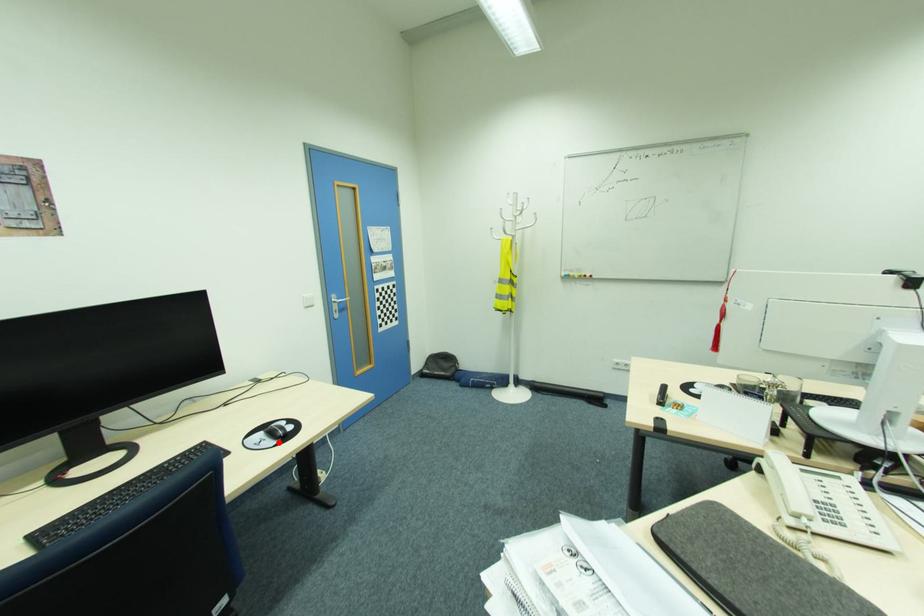
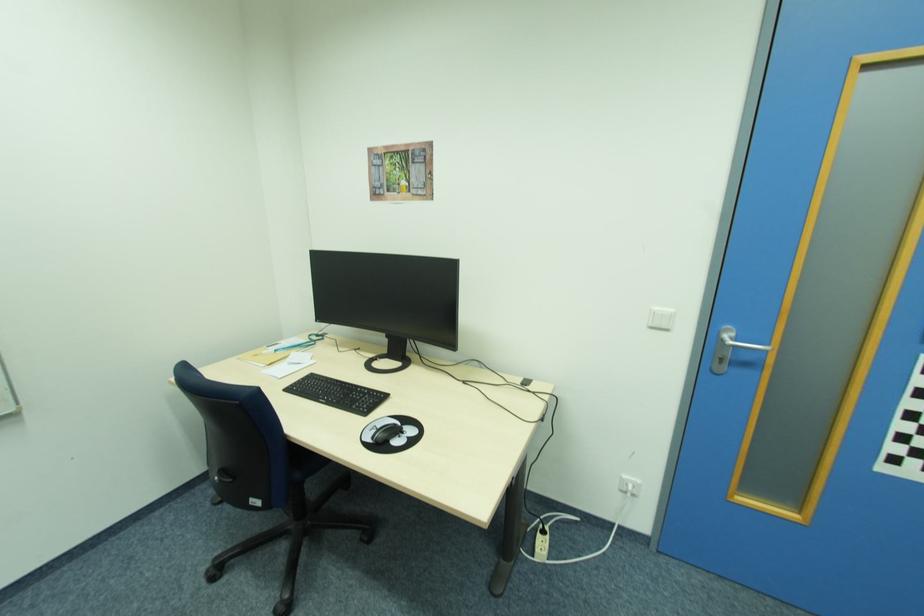
Find the pixel in the second image that matches the highlighted location in the first image.

(372, 440)